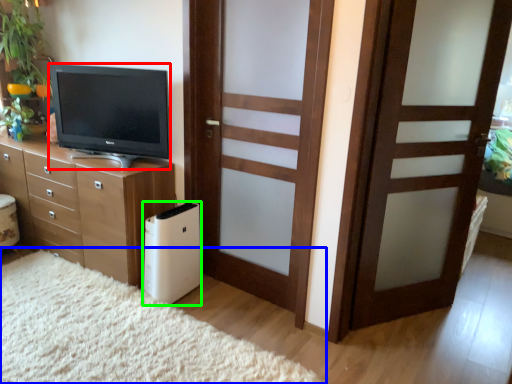
Question: Which object is positioned closest to television (highlighted by a red box)? Select from plain (highlighted by a blue box) and appliance (highlighted by a green box).

Choices:
 (A) plain
 (B) appliance

Answer: (B)